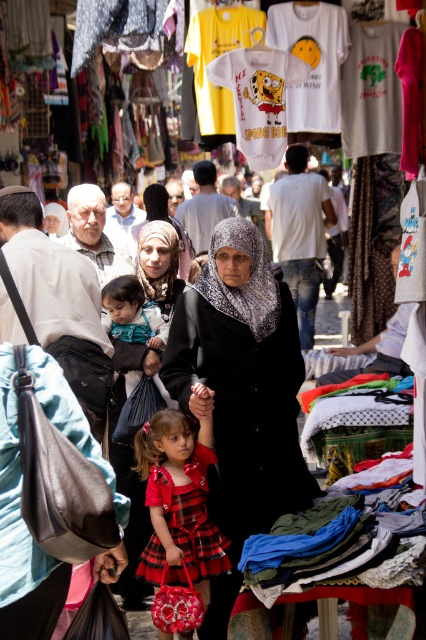
Is point (278, 205) positioned before point (193, 212)?

No.

Does point (310, 346) come in front of point (201, 216)?

No.

Image resolution: width=426 pixels, height=640 pixels. I want to click on white cotton shirt at center, so point(299,240).

Is point (140, 340) positioned before point (198, 221)?

Yes, it is.

Can you confirm if teal satin dress at center is thinner than black textured scarf at center?

Indeed, teal satin dress at center has a lesser width compared to black textured scarf at center.

Which is behind, point (138, 342) or point (183, 221)?

Positioned behind is point (183, 221).

The width and height of the screenshot is (426, 640). Identify the location of teal satin dress at center. (132, 314).

Can you confirm if plaid fabric dress at center is thinner than teal satin dress at center?

In fact, plaid fabric dress at center might be wider than teal satin dress at center.

Can you confirm if plaid fabric dress at center is shorter than teal satin dress at center?

Incorrect, plaid fabric dress at center's height does not fall short of teal satin dress at center's.

Between point (146, 548) and point (124, 308), which one is positioned behind?

The point (124, 308) is behind.

Identify the location of plaid fabric dress at center. (178, 502).